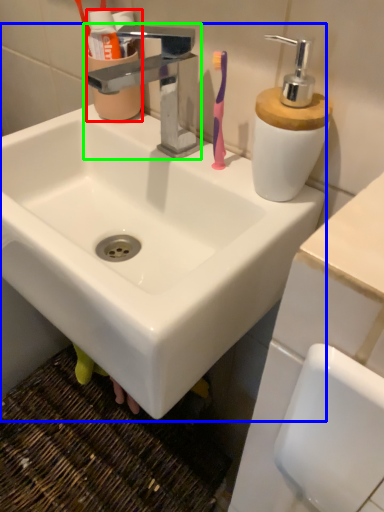
Question: Which is farther away from mouthwash (highlighted by a red box)? sink (highlighted by a blue box) or tap (highlighted by a green box)?

Choices:
 (A) sink
 (B) tap

Answer: (A)